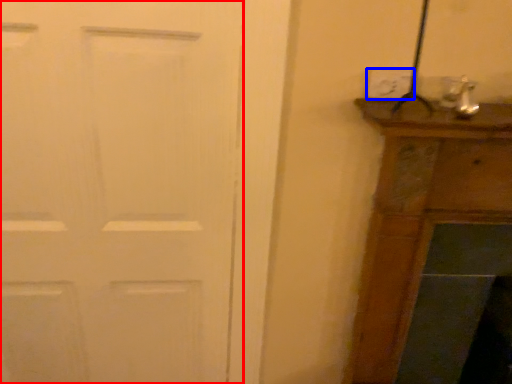
Question: Which object is further to the camera taking this photo, door (highlighted by a red box) or electric outlet (highlighted by a blue box)?

Choices:
 (A) door
 (B) electric outlet

Answer: (B)